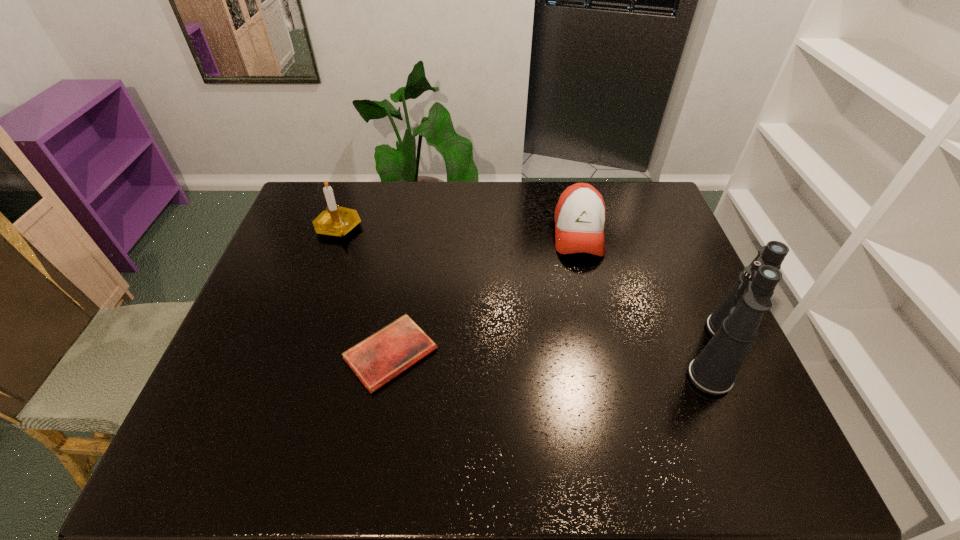
Locate an element on the screen. The height and width of the screenshot is (540, 960). vacant region located 0.230m on the front-facing side of the second object from right to left is located at coordinates (589, 324).

Image resolution: width=960 pixels, height=540 pixels. I want to click on vacant position located on the front-facing side of the second object from right to left, so click(592, 352).

I want to click on vacant space situated on the front-facing side of the second object from right to left, so click(589, 321).

You are a GUI agent. You are given a task and a screenshot of the screen. Output one action in this format:
    pyautogui.click(x=<x>, y=<y>)
    Task: Click on the vacant space located 0.350m with a handle on the second tallest object
    Image resolution: width=960 pixels, height=540 pixels.
    Given the screenshot: What is the action you would take?
    pyautogui.click(x=427, y=295)

Where is `free space located 0.370m with a handle on the second tallest object`? free space located 0.370m with a handle on the second tallest object is located at coordinates (432, 299).

You are a GUI agent. You are given a task and a screenshot of the screen. Output one action in this format:
    pyautogui.click(x=<x>, y=<y>)
    Task: Click on the free space located with a handle on the second tallest object
    
    Given the screenshot: What is the action you would take?
    pyautogui.click(x=380, y=260)

Locate an element on the screen. This screenshot has height=540, width=960. baseball cap positioned at the far edge is located at coordinates (580, 214).

You are a GUI agent. You are given a task and a screenshot of the screen. Output one action in this format:
    pyautogui.click(x=<x>, y=<y>)
    Task: Click on the candle holder that is at the far edge
    This screenshot has height=540, width=960.
    Given the screenshot: What is the action you would take?
    pyautogui.click(x=336, y=221)

Locate an element on the screen. diary that is at the near edge is located at coordinates [x=379, y=358].

Locate an element on the screen. binoculars situated at the near edge is located at coordinates (733, 326).